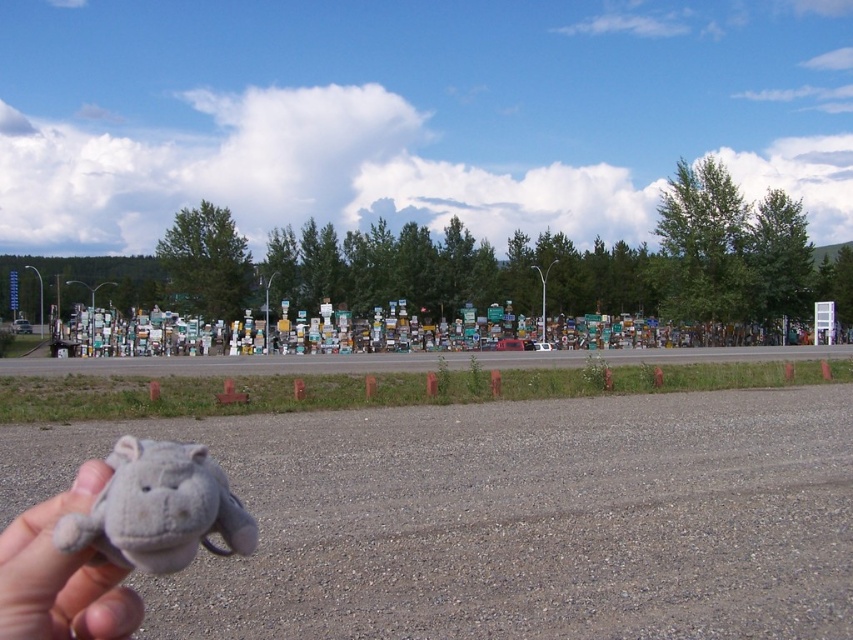
Is gray plush hippo at lower left wider than fuzzy gray stuffed animal at lower left?

Correct, the width of gray plush hippo at lower left exceeds that of fuzzy gray stuffed animal at lower left.

Between gray plush hippo at lower left and fuzzy gray stuffed animal at lower left, which one appears on the right side from the viewer's perspective?

gray plush hippo at lower left is more to the right.

Identify the location of gray plush hippo at lower left. Image resolution: width=853 pixels, height=640 pixels. (160, 509).